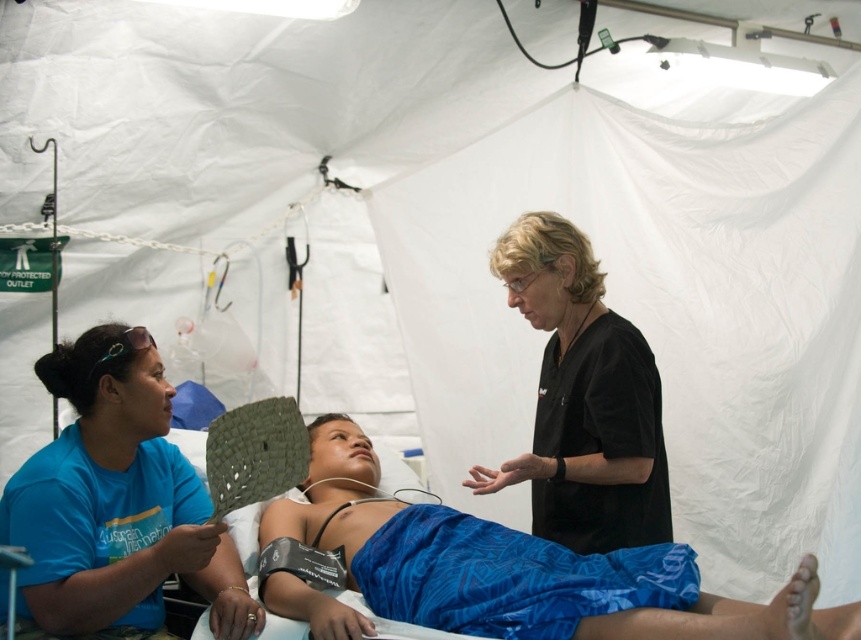
Question: Is blue fabric at center to the left of black scrubs at center from the viewer's perspective?

Choices:
 (A) yes
 (B) no

Answer: (A)

Question: Which point is farther from the camera taking this photo?

Choices:
 (A) (85, 380)
 (B) (651, 609)
 (C) (608, 456)

Answer: (C)

Question: In this image, where is blue fabric shirt at left located relative to black scrubs at center?

Choices:
 (A) left
 (B) right

Answer: (A)

Question: Which point is closer to the camera?

Choices:
 (A) (172, 477)
 (B) (454, 534)
 (C) (646, 528)

Answer: (B)

Question: Which object is closer to the camera taking this photo?

Choices:
 (A) black scrubs at center
 (B) blue fabric shirt at left
 (C) blue fabric at center

Answer: (C)

Question: Is the position of blue fabric at center more distant than that of black scrubs at center?

Choices:
 (A) yes
 (B) no

Answer: (B)